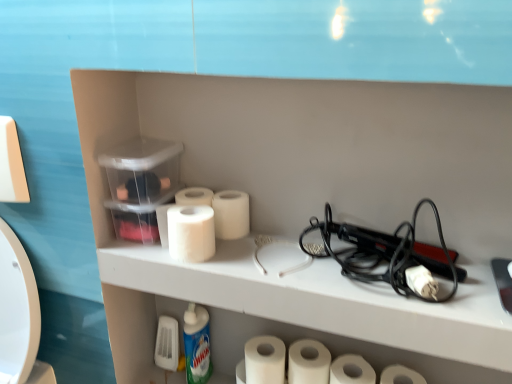
Question: Does white glossy bottle at lower center have a lesser width compared to black plastic hair straightener at right?

Choices:
 (A) yes
 (B) no

Answer: (A)

Question: Can you confirm if white glossy bottle at lower center is bigger than black plastic hair straightener at right?

Choices:
 (A) yes
 (B) no

Answer: (B)

Question: Is white glossy bottle at lower center further to the viewer compared to black plastic hair straightener at right?

Choices:
 (A) yes
 (B) no

Answer: (A)

Question: Can you confirm if white glossy bottle at lower center is taller than black plastic hair straightener at right?

Choices:
 (A) yes
 (B) no

Answer: (A)

Question: Are white glossy bottle at lower center and black plastic hair straightener at right beside each other?

Choices:
 (A) yes
 (B) no

Answer: (B)

Question: From a real-world perspective, relative to white matte toilet paper at center, placed as the 2th toilet paper when sorted from right to left, is white matte toilet paper at center, marked as the 2th toilet paper in a left-to-right arrangement, vertically above or below?

Choices:
 (A) above
 (B) below

Answer: (A)

Question: From the image's perspective, is white matte toilet paper at center, which ranks as the 5th toilet paper in right-to-left order, above or below white matte toilet paper at center, placed as the 2th toilet paper when sorted from right to left?

Choices:
 (A) below
 (B) above

Answer: (B)

Question: Would you say white matte toilet paper at center, marked as the 2th toilet paper in a left-to-right arrangement, is to the left or to the right of white matte toilet paper at center, placed as the 2th toilet paper when sorted from right to left, in the picture?

Choices:
 (A) right
 (B) left

Answer: (B)

Question: In the image, is white matte toilet paper at center, which ranks as the 5th toilet paper in right-to-left order, positioned in front of or behind white matte toilet paper at center, marked as the 5th toilet paper in a left-to-right arrangement?

Choices:
 (A) front
 (B) behind

Answer: (B)

Question: Does point (428, 281) appear closer or farther from the camera than point (346, 379)?

Choices:
 (A) closer
 (B) farther

Answer: (A)

Question: From a real-world perspective, is white matte toilet paper at center, marked as the 5th toilet paper in a left-to-right arrangement, positioned above or below white matte toilet paper at lower center, which ranks as the 4th toilet paper in left-to-right order?

Choices:
 (A) below
 (B) above

Answer: (B)

Question: In terms of size, does white matte toilet paper at center, placed as the 2th toilet paper when sorted from right to left, appear bigger or smaller than white matte toilet paper at lower center, which ranks as the 4th toilet paper in left-to-right order?

Choices:
 (A) big
 (B) small

Answer: (B)

Question: Considering their positions, is white matte toilet paper at center, marked as the 5th toilet paper in a left-to-right arrangement, located in front of or behind white matte toilet paper at lower center, which ranks as the 4th toilet paper in left-to-right order?

Choices:
 (A) behind
 (B) front

Answer: (B)

Question: Considering the relative positions of white matte toilet paper at center, which ranks as the 5th toilet paper in right-to-left order, and black plastic hair straightener at right in the image provided, is white matte toilet paper at center, which ranks as the 5th toilet paper in right-to-left order, to the left or to the right of black plastic hair straightener at right?

Choices:
 (A) right
 (B) left

Answer: (B)

Question: Do you think white matte toilet paper at center, marked as the 2th toilet paper in a left-to-right arrangement, is within black plastic hair straightener at right, or outside of it?

Choices:
 (A) outside
 (B) inside

Answer: (A)